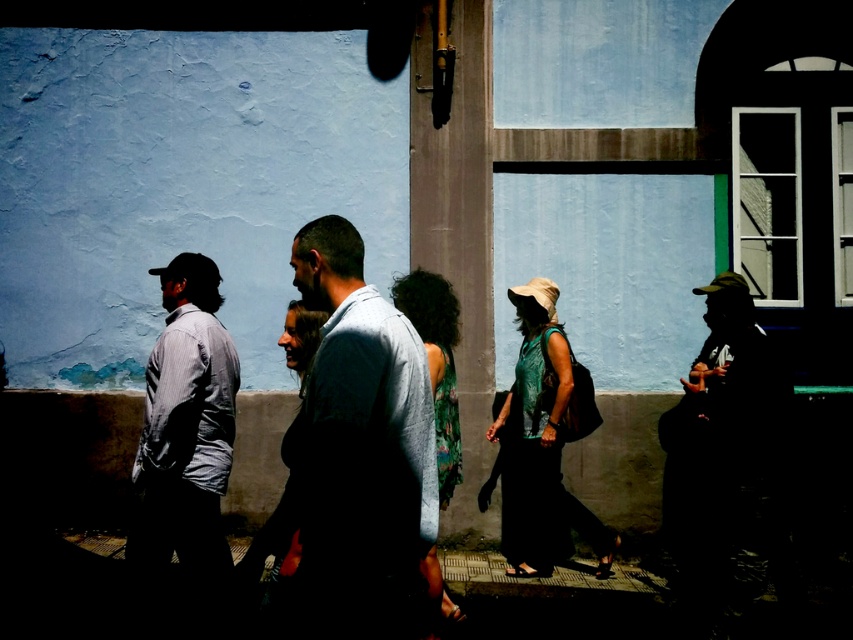
You are standing on the street in front of the blue building and want to reach both the point at coordinates (772, 392) and the point at coordinates (444, 508). Which point will you reach first as you walk towards them?

You will reach the point at coordinates (772, 392) first because it is closer to you than the point at coordinates (444, 508).

You are a photographer who wants to capture the shadows of the silhouette hat at right and the green textured top at center in the same frame. Given their height difference, which object will cast a longer shadow?

The silhouette hat at right is much taller than the green textured top at center, so it will cast a longer shadow.

In the scene shown: You are a photographer who wants to capture the silhouette hat at right and the floral fabric dress at center in a single frame. Given that your camera has a fixed focal length and limited depth of field, which object should you focus on to ensure the larger one is in sharp focus while the smaller one remains recognizable but slightly blurred?

The silhouette hat at right is bigger than the floral fabric dress at center, so you should focus on the silhouette hat at right to ensure it is in sharp focus while the floral fabric dress at center remains recognizable but slightly blurred.